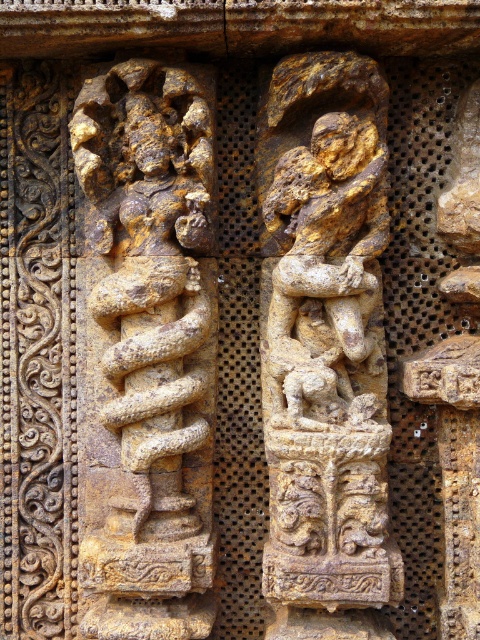
Question: Is golden stone snake at left thinner than golden stone figure at center?

Choices:
 (A) yes
 (B) no

Answer: (B)

Question: Can you confirm if golden stone snake at left is positioned to the right of golden stone figure at center?

Choices:
 (A) yes
 (B) no

Answer: (B)

Question: Which object appears farthest from the camera in this image?

Choices:
 (A) golden stone snake at left
 (B) golden stone figure at center

Answer: (A)

Question: Does golden stone snake at left have a greater width compared to golden stone figure at center?

Choices:
 (A) no
 (B) yes

Answer: (B)